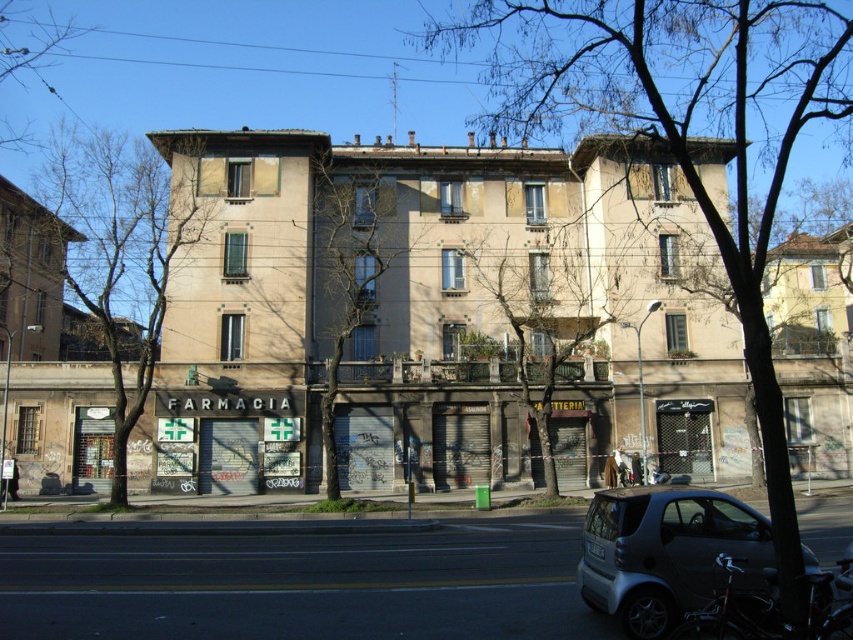
Can you confirm if bare branches at center is wider than shiny black bicycle at lower right?

Correct, the width of bare branches at center exceeds that of shiny black bicycle at lower right.

What do you see at coordinates (538, 317) in the screenshot? I see `bare branches at center` at bounding box center [538, 317].

Where is `bare branches at center`? bare branches at center is located at coordinates point(538,317).

Who is positioned more to the left, shiny black bicycle at lower right or brown textured tree at upper left?

Positioned to the left is brown textured tree at upper left.

Is point (741, 621) positioned in front of point (47, 32)?

Yes, it is.

Who is more distant from viewer, (809, 595) or (38, 80)?

The point (38, 80) is more distant.

Locate an element on the screen. The width and height of the screenshot is (853, 640). shiny black bicycle at lower right is located at coordinates (770, 609).

Is point (123, 172) farther from camera compared to point (16, 140)?

No.

What are the coordinates of `brown textured tree at left` in the screenshot? It's located at (120, 253).